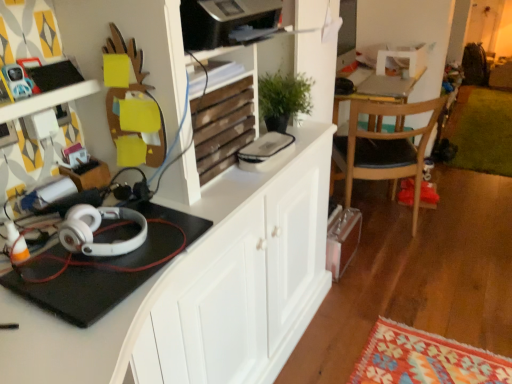
The image size is (512, 384). I want to click on free space to the right of wooden chair with black seat cushion at right, so click(x=457, y=225).